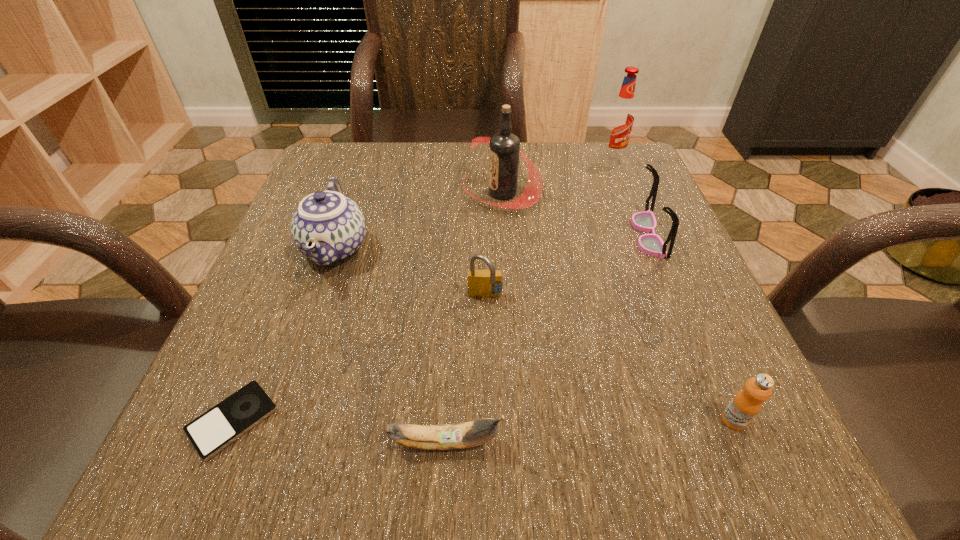
Locate an element on the screen. This screenshot has height=540, width=960. blank space located 0.150m on the label of the left root beer is located at coordinates coord(393,193).

Image resolution: width=960 pixels, height=540 pixels. I want to click on vacant space located 0.220m on the label of the left root beer, so click(360, 193).

Where is `vacant space located on the label of the left root beer`? vacant space located on the label of the left root beer is located at coordinates (384, 193).

In order to click on free region located 0.090m from the spout of the chinaware in this screenshot , I will do `click(306, 332)`.

Locate an element on the screen. The height and width of the screenshot is (540, 960). free space located 0.340m on the left of the spectacles is located at coordinates (457, 234).

At what (x,y) coordinates should I click in order to perform the action: click on vacant space located on the side with the combination dials of the fourth nearest object. Please return your answer as a coordinate pair (x, y). This screenshot has width=960, height=540. Looking at the image, I should click on (487, 443).

Identify the location of vacant region located 0.170m on the peel of the seventh tallest object. (636, 442).

Find the location of `vacant space located 0.350m on the back of the iPod`. vacant space located 0.350m on the back of the iPod is located at coordinates pyautogui.click(x=314, y=228).

Identify the location of orange juice situated at the near edge. (746, 404).

Where is `banana that is at the near edge`? The image size is (960, 540). banana that is at the near edge is located at coordinates (468, 434).